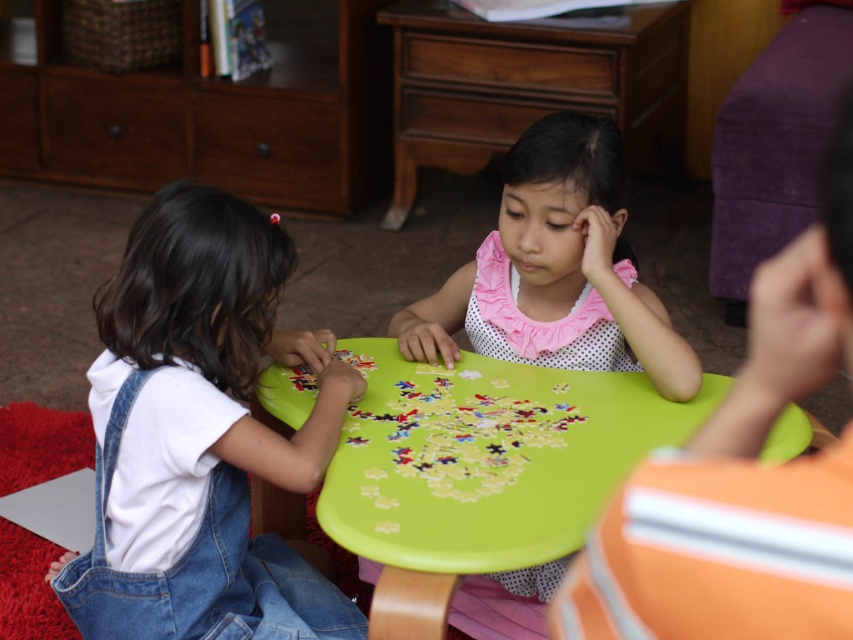
You are a parent observing the children at the white denim overalls at left and the green plastic table at center. Which object is positioned higher from the ground?

The white denim overalls at left is above the green plastic table at center, so the white denim overalls at left is higher from the ground.

You are a robot trying to pick up the puzzle pieces from the table. The robot can only reach points that are closer to it. If the robot is positioned at the same level as the table, which point would you first reach, point (x=577, y=518) or point (x=546, y=403)?

Point (x=577, y=518) is closer to the viewer than point (x=546, y=403), so the robot would first reach point (x=577, y=518).

You are a parent who wants to ensure the children can comfortably reach the puzzle pieces on the green plastic table at center while wearing their white denim overalls at left. Based on their height, do you think the table is at a suitable height for them?

The white denim overalls at left is taller than the green plastic table at center, so the table may be too low for the children to comfortably reach the puzzle pieces.